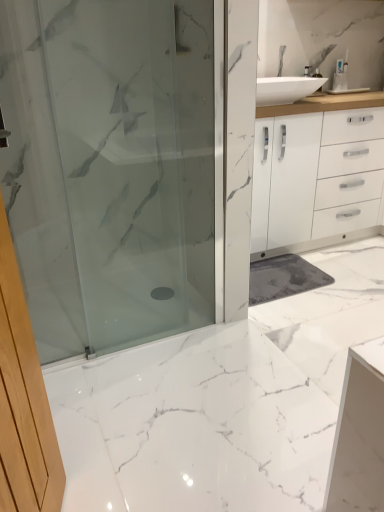
Question: Is white marble floor at center far from white plastic toothbrush at upper right?

Choices:
 (A) no
 (B) yes

Answer: (B)

Question: From the image's perspective, is white marble floor at center located beneath white plastic toothbrush at upper right?

Choices:
 (A) yes
 (B) no

Answer: (A)

Question: Does white marble floor at center have a lesser width compared to white plastic toothbrush at upper right?

Choices:
 (A) yes
 (B) no

Answer: (B)

Question: Could you tell me if white marble floor at center is turned towards white plastic toothbrush at upper right?

Choices:
 (A) yes
 (B) no

Answer: (B)

Question: Does white marble floor at center have a smaller size compared to white plastic toothbrush at upper right?

Choices:
 (A) yes
 (B) no

Answer: (B)

Question: In the image, is white plastic toothbrush at upper right positioned in front of or behind white marble floor at center?

Choices:
 (A) front
 (B) behind

Answer: (B)

Question: From a real-world perspective, is white plastic toothbrush at upper right physically located above or below white marble floor at center?

Choices:
 (A) above
 (B) below

Answer: (A)

Question: From their relative heights in the image, would you say white plastic toothbrush at upper right is taller or shorter than white marble floor at center?

Choices:
 (A) tall
 (B) short

Answer: (A)

Question: From the image's perspective, is white plastic toothbrush at upper right above or below white marble floor at center?

Choices:
 (A) above
 (B) below

Answer: (A)

Question: Do you think white marble floor at center is within white plastic toothbrush at upper right, or outside of it?

Choices:
 (A) outside
 (B) inside

Answer: (A)

Question: In terms of height, does white marble floor at center look taller or shorter compared to white plastic toothbrush at upper right?

Choices:
 (A) short
 (B) tall

Answer: (A)

Question: Would you say white marble floor at center is to the left or to the right of white plastic toothbrush at upper right in the picture?

Choices:
 (A) left
 (B) right

Answer: (A)

Question: From the image's perspective, is white marble floor at center positioned above or below white plastic toothbrush at upper right?

Choices:
 (A) below
 (B) above

Answer: (A)

Question: Is white marble floor at center bigger or smaller than satin glass shower door at center?

Choices:
 (A) small
 (B) big

Answer: (B)

Question: Considering the positions of white marble floor at center and satin glass shower door at center in the image, is white marble floor at center taller or shorter than satin glass shower door at center?

Choices:
 (A) tall
 (B) short

Answer: (B)